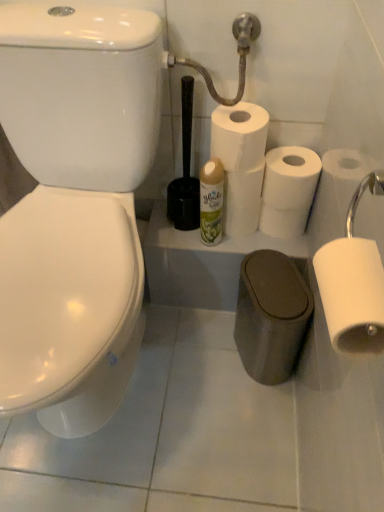
How much space does white matte toilet paper at center, which appears as the fifth toilet paper when viewed from the front, occupy horizontally?

The width of white matte toilet paper at center, which appears as the fifth toilet paper when viewed from the front, is 12.24 centimeters.

Locate an element on the screen. The height and width of the screenshot is (512, 384). white matte toilet paper at right, which ranks as the 5th toilet paper in back-to-front order is located at coordinates (352, 294).

This screenshot has width=384, height=512. Describe the element at coordinates (288, 190) in the screenshot. I see `white matte toilet paper at center right, which is counted as the third toilet paper, starting from the front` at that location.

The height and width of the screenshot is (512, 384). In order to click on white matte toilet paper at center, positioned as the 4th toilet paper in front-to-back order in this screenshot , I will do `click(283, 221)`.

Identify the location of white matte toilet paper at center, which appears as the 1th toilet paper when viewed from the back. The width and height of the screenshot is (384, 512). [x=242, y=201].

Does point (337, 349) lie behind point (253, 130)?

That is False.

Which object is more forward, white matte toilet paper at right, which ranks as the 5th toilet paper in back-to-front order, or white matte toilet paper at center, the fourth toilet paper when ordered from back to front?

white matte toilet paper at right, which ranks as the 5th toilet paper in back-to-front order, is in front.

Consider the image. Is white matte toilet paper at right, which ranks as the 5th toilet paper in back-to-front order, touching white matte toilet paper at center, the fourth toilet paper when ordered from back to front?

No.

Is white matte toilet paper at center right, arranged as the 3th toilet paper when viewed from the back, far from white matte toilet paper at center, positioned as the 2th toilet paper in back-to-front order?

white matte toilet paper at center right, arranged as the 3th toilet paper when viewed from the back, is near white matte toilet paper at center, positioned as the 2th toilet paper in back-to-front order, not far away.

From the image's perspective, would you say white matte toilet paper at center right, which is counted as the third toilet paper, starting from the front, is shown under white matte toilet paper at center, positioned as the 2th toilet paper in back-to-front order?

Actually, white matte toilet paper at center right, which is counted as the third toilet paper, starting from the front, appears above white matte toilet paper at center, positioned as the 2th toilet paper in back-to-front order, in the image.

Considering the sizes of objects white matte toilet paper at center right, which is counted as the third toilet paper, starting from the front, and white matte toilet paper at center, positioned as the 4th toilet paper in front-to-back order, in the image provided, who is thinner, white matte toilet paper at center right, which is counted as the third toilet paper, starting from the front, or white matte toilet paper at center, positioned as the 4th toilet paper in front-to-back order,?

white matte toilet paper at center, positioned as the 4th toilet paper in front-to-back order, is thinner.

Between white matte toilet paper at right, which ranks as the 5th toilet paper in back-to-front order, and white matte toilet paper at center, which appears as the 1th toilet paper when viewed from the back, which one has less height?

With less height is white matte toilet paper at right, which ranks as the 5th toilet paper in back-to-front order.

Is white matte toilet paper at right, acting as the first toilet paper starting from the front, spatially inside white matte toilet paper at center, which appears as the fifth toilet paper when viewed from the front, or outside of it?

white matte toilet paper at right, acting as the first toilet paper starting from the front, is located beyond the bounds of white matte toilet paper at center, which appears as the fifth toilet paper when viewed from the front.

Is white matte toilet paper at right, acting as the first toilet paper starting from the front, closer to camera compared to white matte toilet paper at center, which appears as the 1th toilet paper when viewed from the back?

Yes.

Is white matte toilet paper at right, acting as the first toilet paper starting from the front, facing away from white matte toilet paper at center, which appears as the fifth toilet paper when viewed from the front?

No, white matte toilet paper at right, acting as the first toilet paper starting from the front,'s orientation is not away from white matte toilet paper at center, which appears as the fifth toilet paper when viewed from the front.

Considering the relative positions of white matte toilet paper at center, which appears as the fifth toilet paper when viewed from the front, and black plastic toilet brush at center in the image provided, is white matte toilet paper at center, which appears as the fifth toilet paper when viewed from the front, to the left or to the right of black plastic toilet brush at center?

white matte toilet paper at center, which appears as the fifth toilet paper when viewed from the front, is to the right of black plastic toilet brush at center.

From the image's perspective, which one is positioned higher, white matte toilet paper at center, which appears as the 1th toilet paper when viewed from the back, or black plastic toilet brush at center?

black plastic toilet brush at center appears higher in the image.

Considering the positions of point (259, 179) and point (176, 223), is point (259, 179) closer or farther from the camera than point (176, 223)?

Point (259, 179).

Which of these two, white matte toilet paper at center, which appears as the fifth toilet paper when viewed from the front, or black plastic toilet brush at center, is wider?

With larger width is white matte toilet paper at center, which appears as the fifth toilet paper when viewed from the front.

Are white matte toilet paper at right, which ranks as the 5th toilet paper in back-to-front order, and white glossy air freshener at center located far from each other?

That's not correct — white matte toilet paper at right, which ranks as the 5th toilet paper in back-to-front order, is a little close to white glossy air freshener at center.

From a real-world perspective, who is located higher, white matte toilet paper at right, which ranks as the 5th toilet paper in back-to-front order, or white glossy air freshener at center?

white matte toilet paper at right, which ranks as the 5th toilet paper in back-to-front order, is physically above.

Is point (346, 347) in front of point (205, 208)?

Yes, it is in front of point (205, 208).

Is white matte toilet paper at right, acting as the first toilet paper starting from the front, turned away from white glossy air freshener at center?

white matte toilet paper at right, acting as the first toilet paper starting from the front, does not have its back to white glossy air freshener at center.

Is white glossy air freshener at center behind black plastic toilet brush at center?

Yes, white glossy air freshener at center is further from the viewer.

Looking at this image, from a real-world perspective, is white glossy air freshener at center over black plastic toilet brush at center?

Actually, white glossy air freshener at center is physically below black plastic toilet brush at center in the real world.

Is white glossy air freshener at center aimed at black plastic toilet brush at center?

No, white glossy air freshener at center does not turn towards black plastic toilet brush at center.

Is white glossy air freshener at center inside or outside of black plastic toilet brush at center?

white glossy air freshener at center is outside black plastic toilet brush at center.

Considering the sizes of objects white matte toilet paper at center, which is the 2th toilet paper from front to back, and white matte toilet paper at center, which appears as the 1th toilet paper when viewed from the back, in the image provided, who is wider, white matte toilet paper at center, which is the 2th toilet paper from front to back, or white matte toilet paper at center, which appears as the 1th toilet paper when viewed from the back,?

Wider between the two is white matte toilet paper at center, which is the 2th toilet paper from front to back.

From a real-world perspective, is white matte toilet paper at center, which is the 2th toilet paper from front to back, located beneath white matte toilet paper at center, which appears as the 1th toilet paper when viewed from the back?

Actually, white matte toilet paper at center, which is the 2th toilet paper from front to back, is physically above white matte toilet paper at center, which appears as the 1th toilet paper when viewed from the back, in the real world.

Is white matte toilet paper at center, which is the 2th toilet paper from front to back, positioned with its back to white matte toilet paper at center, which appears as the fifth toilet paper when viewed from the front?

No, white matte toilet paper at center, which is the 2th toilet paper from front to back, is not facing away from white matte toilet paper at center, which appears as the fifth toilet paper when viewed from the front.

Can you tell me how much white matte toilet paper at center, the fourth toilet paper when ordered from back to front, and white matte toilet paper at center, which appears as the fifth toilet paper when viewed from the front, differ in facing direction?

white matte toilet paper at center, the fourth toilet paper when ordered from back to front, and white matte toilet paper at center, which appears as the fifth toilet paper when viewed from the front, are facing 0.000308 degrees away from each other.

From the image's perspective, starting from the white matte toilet paper at center, the fourth toilet paper when ordered from back to front, which toilet paper is the 4th one below? Please provide its 2D coordinates.

[(352, 294)]

I want to click on the 1st toilet paper below the white matte toilet paper at center right, which is counted as the third toilet paper, starting from the front (from a real-world perspective), so click(x=283, y=221).

Considering their positions, is white matte toilet paper at center, positioned as the 4th toilet paper in front-to-back order, positioned closer to white glossy air freshener at center than white matte toilet paper at center, which appears as the fifth toilet paper when viewed from the front?

white matte toilet paper at center, which appears as the fifth toilet paper when viewed from the front, is positioned closer to the anchor white glossy air freshener at center.

Which object lies nearer to the anchor point white matte toilet paper at center, positioned as the 2th toilet paper in back-to-front order, black plastic toilet brush at center or white glossy air freshener at center?

white glossy air freshener at center lies closer to white matte toilet paper at center, positioned as the 2th toilet paper in back-to-front order, than the other object.

Based on their spatial positions, is white matte toilet paper at center right, which is counted as the third toilet paper, starting from the front, or black plastic toilet brush at center further from white matte toilet paper at center, which is the 2th toilet paper from front to back?

The object further to white matte toilet paper at center, which is the 2th toilet paper from front to back, is black plastic toilet brush at center.

Based on their spatial positions, is white glossy air freshener at center or white matte toilet paper at center, the fourth toilet paper when ordered from back to front, further from white matte toilet paper at right, which ranks as the 5th toilet paper in back-to-front order?

The object further to white matte toilet paper at right, which ranks as the 5th toilet paper in back-to-front order, is white glossy air freshener at center.

Looking at the image, which one is located further to white matte toilet paper at center, which appears as the 1th toilet paper when viewed from the back, black plastic toilet brush at center or white matte toilet paper at right, which ranks as the 5th toilet paper in back-to-front order?

white matte toilet paper at right, which ranks as the 5th toilet paper in back-to-front order, is positioned further to the anchor white matte toilet paper at center, which appears as the 1th toilet paper when viewed from the back.

Based on their spatial positions, is black plastic toilet brush at center or white matte toilet paper at right, which ranks as the 5th toilet paper in back-to-front order, closer to white glossy air freshener at center?

black plastic toilet brush at center.

Based on their spatial positions, is white matte toilet paper at center, which is the 2th toilet paper from front to back, or white matte toilet paper at center right, which is counted as the third toilet paper, starting from the front, further from white glossy air freshener at center?

white matte toilet paper at center right, which is counted as the third toilet paper, starting from the front.

From the image, which object appears to be farther from white matte toilet paper at center, which appears as the fifth toilet paper when viewed from the front, white matte toilet paper at right, acting as the first toilet paper starting from the front, or white matte toilet paper at center, positioned as the 2th toilet paper in back-to-front order?

white matte toilet paper at right, acting as the first toilet paper starting from the front, is positioned further to the anchor white matte toilet paper at center, which appears as the fifth toilet paper when viewed from the front.

I want to click on toiletry located between white matte toilet paper at right, acting as the first toilet paper starting from the front, and white matte toilet paper at center, positioned as the 4th toilet paper in front-to-back order, in the depth direction, so click(211, 202).

Where is `brush between white matte toilet paper at right, which ranks as the 5th toilet paper in back-to-front order, and white matte toilet paper at center, positioned as the 2th toilet paper in back-to-front order, in the front-back direction`? Image resolution: width=384 pixels, height=512 pixels. brush between white matte toilet paper at right, which ranks as the 5th toilet paper in back-to-front order, and white matte toilet paper at center, positioned as the 2th toilet paper in back-to-front order, in the front-back direction is located at coordinates (185, 170).

Where is `toiletry between white matte toilet paper at right, which ranks as the 5th toilet paper in back-to-front order, and white matte toilet paper at center, which appears as the fifth toilet paper when viewed from the front, along the z-axis`? This screenshot has height=512, width=384. toiletry between white matte toilet paper at right, which ranks as the 5th toilet paper in back-to-front order, and white matte toilet paper at center, which appears as the fifth toilet paper when viewed from the front, along the z-axis is located at coordinates (211, 202).

Locate an element on the screen. toilet paper between white matte toilet paper at right, acting as the first toilet paper starting from the front, and white matte toilet paper at center right, which is counted as the third toilet paper, starting from the front, in the front-back direction is located at coordinates (239, 135).